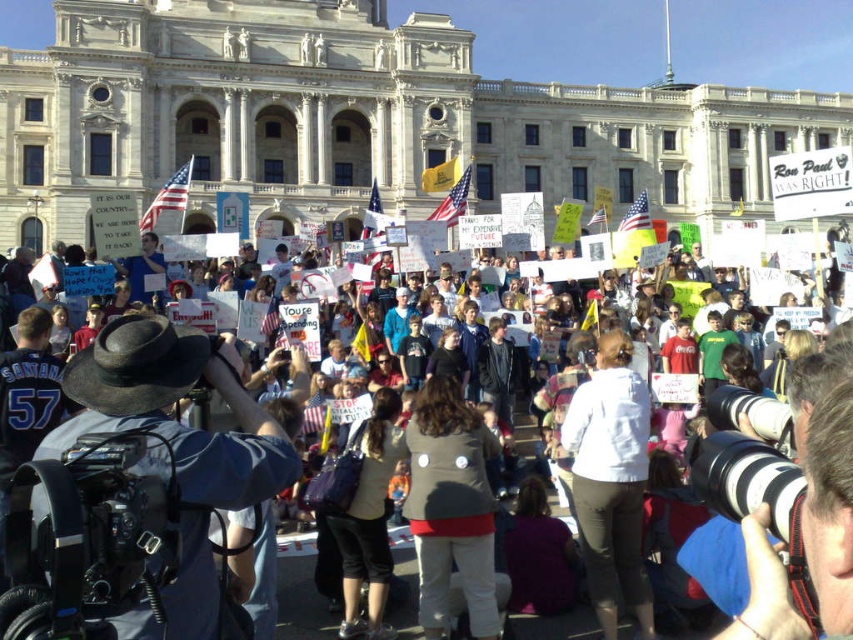
Between white matte shirt at center and matte brown jacket at center, which one has more height?

Standing taller between the two is white matte shirt at center.

Is point (631, 560) positioned before point (366, 576)?

No, (631, 560) is further to viewer.

Is point (590, 445) less distant than point (374, 509)?

No.

At what (x,y) coordinates should I click in order to perform the action: click on white matte shirt at center. Please return your answer as a coordinate pair (x, y). Image resolution: width=853 pixels, height=640 pixels. Looking at the image, I should click on (611, 481).

Is point (215, 380) positioned after point (461, 435)?

No, (215, 380) is closer to viewer.

Is denim jacket at lower left to the right of gray fabric jacket at center from the viewer's perspective?

In fact, denim jacket at lower left is to the left of gray fabric jacket at center.

Is point (260, 461) positioned behind point (457, 520)?

That is False.

At what (x,y) coordinates should I click in order to perform the action: click on denim jacket at lower left. Please return your answer as a coordinate pair (x, y). This screenshot has width=853, height=640. Looking at the image, I should click on (177, 448).

Which is more to the right, denim jacket at lower left or white paper signs at center?

white paper signs at center

Who is lower down, denim jacket at lower left or white paper signs at center?

Positioned lower is white paper signs at center.

Between point (172, 609) and point (772, 609), which one is positioned behind?

The point (172, 609) is more distant.

Where is `denim jacket at lower left`? The height and width of the screenshot is (640, 853). denim jacket at lower left is located at coordinates (177, 448).